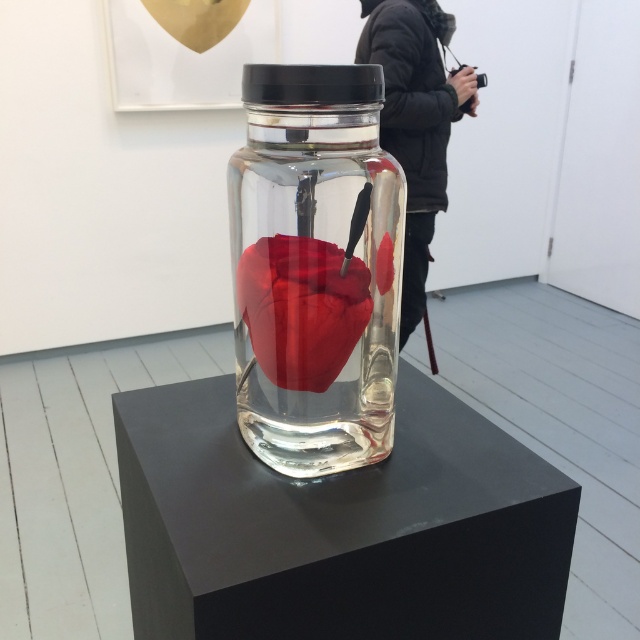
Is transparent glass jar at center positioned in front of black jacket at center?

Yes, transparent glass jar at center is in front of black jacket at center.

Who is positioned more to the right, transparent glass jar at center or black jacket at center?

black jacket at center is more to the right.

At what (x,y) coordinates should I click in order to perform the action: click on transparent glass jar at center. Please return your answer as a coordinate pair (x, y). Image resolution: width=640 pixels, height=640 pixels. Looking at the image, I should click on (314, 268).

Can you confirm if black jacket at center is positioned below matte red heart at center?

No.

Who is lower down, black jacket at center or matte red heart at center?

Positioned lower is matte red heart at center.

Where is `black jacket at center`? This screenshot has height=640, width=640. black jacket at center is located at coordinates (416, 122).

Is point (362, 77) closer to camera compared to point (364, 323)?

That is True.

What do you see at coordinates (314, 268) in the screenshot? This screenshot has height=640, width=640. I see `transparent glass jar at center` at bounding box center [314, 268].

Find the location of a particular element. transparent glass jar at center is located at coordinates (314, 268).